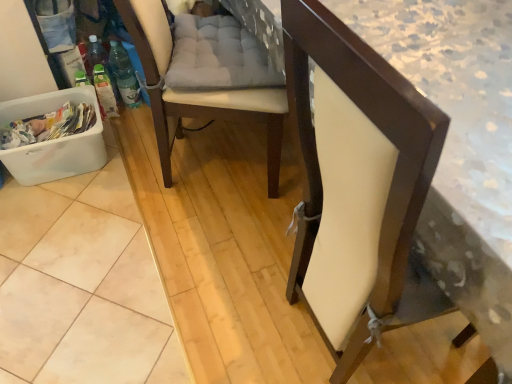
Question: Does matte white chair at center, the 2th chair in the left-to-right sequence, come behind white leather chair at center, which is the first chair from left to right?

Choices:
 (A) yes
 (B) no

Answer: (B)

Question: Is matte white chair at center, the 2th chair in the left-to-right sequence, not near white leather chair at center, which is the first chair from left to right?

Choices:
 (A) yes
 (B) no

Answer: (B)

Question: From the image's perspective, is matte white chair at center, the 2th chair in the left-to-right sequence, located above white leather chair at center, which is the second chair from right to left?

Choices:
 (A) yes
 (B) no

Answer: (B)

Question: Can you confirm if matte white chair at center, which is the 1th chair in right-to-left order, is positioned to the left of white leather chair at center, which is the second chair from right to left?

Choices:
 (A) yes
 (B) no

Answer: (B)

Question: Considering the relative sizes of matte white chair at center, which is the 1th chair in right-to-left order, and white leather chair at center, which is the first chair from left to right, in the image provided, is matte white chair at center, which is the 1th chair in right-to-left order, bigger than white leather chair at center, which is the first chair from left to right,?

Choices:
 (A) yes
 (B) no

Answer: (B)

Question: Considering the relative sizes of matte white chair at center, the 2th chair in the left-to-right sequence, and white leather chair at center, which is the second chair from right to left, in the image provided, is matte white chair at center, the 2th chair in the left-to-right sequence, thinner than white leather chair at center, which is the second chair from right to left,?

Choices:
 (A) no
 (B) yes

Answer: (B)

Question: Is white plastic laundry basket at lower left inside matte white chair at center, the 2th chair in the left-to-right sequence?

Choices:
 (A) yes
 (B) no

Answer: (B)

Question: Could you tell me if matte white chair at center, which is the 1th chair in right-to-left order, is facing white plastic laundry basket at lower left?

Choices:
 (A) no
 (B) yes

Answer: (A)

Question: Is the depth of matte white chair at center, which is the 1th chair in right-to-left order, less than that of white plastic laundry basket at lower left?

Choices:
 (A) yes
 (B) no

Answer: (A)

Question: Is matte white chair at center, the 2th chair in the left-to-right sequence, further to the viewer compared to white plastic laundry basket at lower left?

Choices:
 (A) no
 (B) yes

Answer: (A)

Question: From a real-world perspective, is matte white chair at center, the 2th chair in the left-to-right sequence, physically above white plastic laundry basket at lower left?

Choices:
 (A) no
 (B) yes

Answer: (B)

Question: Does matte white chair at center, which is the 1th chair in right-to-left order, have a smaller size compared to white plastic laundry basket at lower left?

Choices:
 (A) yes
 (B) no

Answer: (B)

Question: Is white leather chair at center, which is the first chair from left to right, thinner than matte white chair at center, the 2th chair in the left-to-right sequence?

Choices:
 (A) no
 (B) yes

Answer: (A)